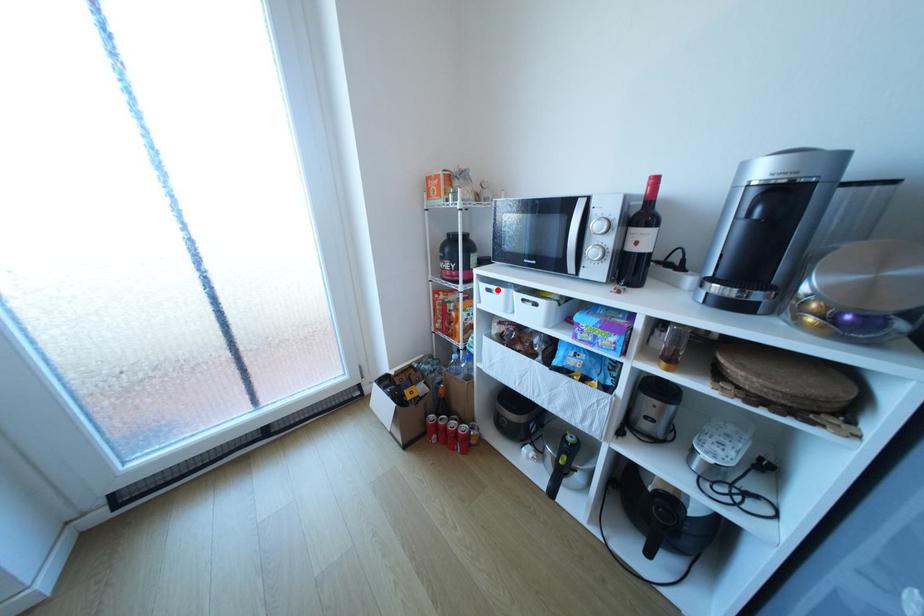
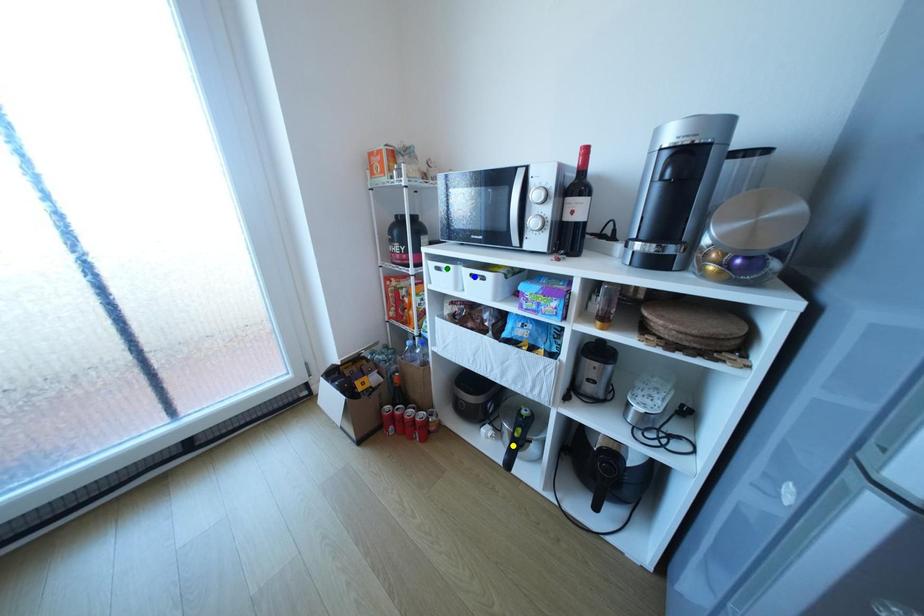
Question: I am providing you with two images of the same scene from different viewpoints. A red point is marked on the first image. You are given multiple points on the second image. Which mark in image 2 goes with the point in image 1?

Choices:
 (A) yellow point
 (B) green point
 (C) blue point

Answer: (B)